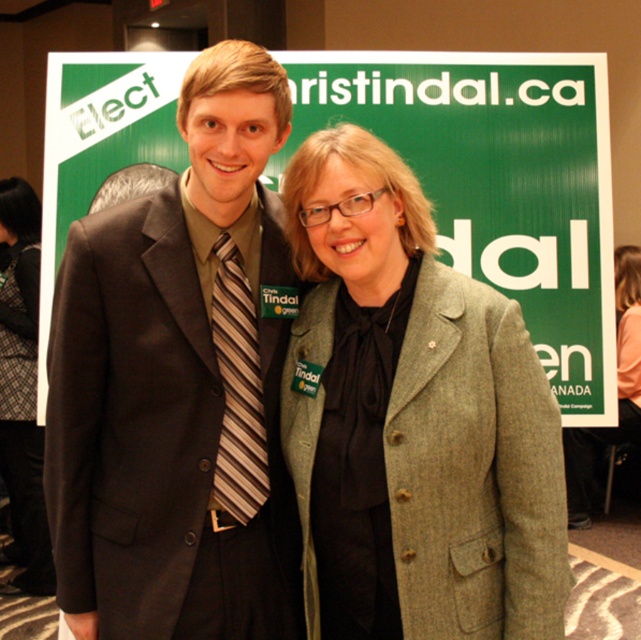
Does point (26, 292) come closer to viewer compared to point (583, 525)?

Yes, point (26, 292) is in front of point (583, 525).

Can you confirm if black lace dress at left is positioned below light brown textured blazer at center?

No.

Which is behind, point (29, 550) or point (628, 300)?

The point (628, 300) is behind.

Find the location of a particular element. Image resolution: width=641 pixels, height=640 pixels. black lace dress at left is located at coordinates (21, 390).

What do you see at coordinates (495, 182) in the screenshot?
I see `green fabric poster at center` at bounding box center [495, 182].

Does green fabric poster at center have a lesser height compared to light brown textured blazer at center?

Yes, green fabric poster at center is shorter than light brown textured blazer at center.

Between point (51, 163) and point (637, 266), which one is positioned behind?

Point (637, 266)

Locate an element on the screen. green fabric poster at center is located at coordinates [495, 182].

Can you confirm if green fabric poster at center is bigger than brown striped tie at center?

Yes.

Can you confirm if green fabric poster at center is positioned below brown striped tie at center?

No, green fabric poster at center is not below brown striped tie at center.

The height and width of the screenshot is (640, 641). I want to click on green fabric poster at center, so tap(495, 182).